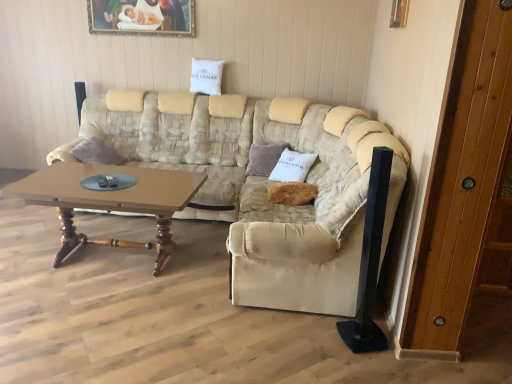
Measure the distance between point (67,202) and camera.

The distance of point (67,202) from camera is 8.98 feet.

Image resolution: width=512 pixels, height=384 pixels. Describe the element at coordinates (264, 158) in the screenshot. I see `velvet purple pillow at center, which appears as the 2th pillow when viewed from the top` at that location.

You are a GUI agent. You are given a task and a screenshot of the screen. Output one action in this format:
    pyautogui.click(x=<x>, y=<y>)
    Task: Click on the beige fabric armchair at center
    The image size is (512, 384).
    Given the screenshot: What is the action you would take?
    [x=302, y=280]

Where is `beige fabric couch at center`? beige fabric couch at center is located at coordinates (265, 190).

What do you see at coordinates (265, 190) in the screenshot? This screenshot has width=512, height=384. I see `beige fabric couch at center` at bounding box center [265, 190].

In order to face metallic gold picture frame at upper right, which ranks as the first picture frame in bottom-to-top order, should I rotate leftwards or rightwards?

Rotate right and turn 18.538 degrees.

This screenshot has width=512, height=384. What are the coordinates of `white fabric pillow at upper center, which ranks as the first pillow in left-to-right order` in the screenshot? It's located at (206, 76).

In terms of size, does white fabric pillow at upper center, which ranks as the first pillow in left-to-right order, appear bigger or smaller than brown wooden coffee table at center?

white fabric pillow at upper center, which ranks as the first pillow in left-to-right order, is smaller than brown wooden coffee table at center.

Based on the photo, considering their positions, is white fabric pillow at upper center, which ranks as the first pillow in left-to-right order, located in front of or behind brown wooden coffee table at center?

In the image, white fabric pillow at upper center, which ranks as the first pillow in left-to-right order, appears behind brown wooden coffee table at center.

Does point (220, 63) come behind point (53, 182)?

Yes, point (220, 63) is behind point (53, 182).

Is point (214, 84) positioned before point (371, 211)?

No, (214, 84) is further to viewer.

Which of these two, white fabric pillow at upper center, the 1th pillow from the back, or beige fabric armchair at center, is bigger?

beige fabric armchair at center.

How different are the orientations of white fabric pillow at upper center, which is counted as the third pillow, starting from the front, and beige fabric armchair at center in degrees?

They differ by 75.2 degrees in their facing directions.

From a real-world perspective, is white fabric pillow at upper center, the 1th pillow from the back, above or below beige fabric armchair at center?

white fabric pillow at upper center, the 1th pillow from the back, is above beige fabric armchair at center.

Considering the positions of points (405, 26) and (170, 109), is point (405, 26) farther from camera compared to point (170, 109)?

No, (405, 26) is in front of (170, 109).

How distant is metallic gold picture frame at upper right, which appears as the second picture frame when viewed from the back, from beige fabric couch at center?

metallic gold picture frame at upper right, which appears as the second picture frame when viewed from the back, and beige fabric couch at center are 5.09 feet apart.

Is metallic gold picture frame at upper right, which is counted as the 1th picture frame, starting from the front, positioned beyond the bounds of beige fabric couch at center?

Indeed, metallic gold picture frame at upper right, which is counted as the 1th picture frame, starting from the front, is completely outside beige fabric couch at center.

Who is shorter, metallic gold picture frame at upper right, which appears as the second picture frame when viewed from the back, or beige fabric couch at center?

With less height is metallic gold picture frame at upper right, which appears as the second picture frame when viewed from the back.

From a real-world perspective, is wooden door at right below beige fabric couch at center?

No, from a real-world perspective, wooden door at right is not under beige fabric couch at center.

From the image's perspective, is wooden door at right located beneath beige fabric couch at center?

Correct, wooden door at right appears lower than beige fabric couch at center in the image.

Based on the photo, considering the positions of objects wooden door at right and beige fabric couch at center in the image provided, who is more to the left, wooden door at right or beige fabric couch at center?

From the viewer's perspective, beige fabric couch at center appears more on the left side.

Which object is closer to the camera, wooden door at right or beige fabric couch at center?

wooden door at right is more forward.

Based on their positions, is fuzzy brown pillow at center, the third pillow from the back, located to the left or right of velvet purple pillow at center, the 2th pillow positioned from the left?

fuzzy brown pillow at center, the third pillow from the back, is to the right of velvet purple pillow at center, the 2th pillow positioned from the left.

Is fuzzy brown pillow at center, arranged as the 3th pillow when viewed from the left, behind velvet purple pillow at center, the second pillow from the bottom?

No, the depth of fuzzy brown pillow at center, arranged as the 3th pillow when viewed from the left, is less than that of velvet purple pillow at center, the second pillow from the bottom.

The height and width of the screenshot is (384, 512). I want to click on pillow that is the 3rd object located above the wooden door at right (from the image's perspective), so click(206, 76).

From the image's perspective, which one is positioned lower, wooden door at right or white fabric pillow at upper center, which ranks as the first pillow in left-to-right order?

From the image's view, wooden door at right is below.

Is white fabric pillow at upper center, which ranks as the first pillow in left-to-right order, inside wooden door at right?

No, white fabric pillow at upper center, which ranks as the first pillow in left-to-right order, is not surrounded by wooden door at right.

Considering the positions of point (490, 154) and point (220, 86), is point (490, 154) closer or farther from the camera than point (220, 86)?

Clearly, point (490, 154) is closer to the camera than point (220, 86).

Between point (288, 183) and point (150, 155), which one is positioned in front?

The point (288, 183) is more forward.

Between fuzzy brown pillow at center, which is the 1th pillow from right to left, and beige fabric couch at center, which one has more height?

beige fabric couch at center.

Is fuzzy brown pillow at center, the 3th pillow viewed from the top, facing towards beige fabric couch at center?

Yes, fuzzy brown pillow at center, the 3th pillow viewed from the top, is turned towards beige fabric couch at center.

Locate an element on the screen. coffee table below the white fabric pillow at upper center, the 3th pillow positioned from the right (from a real-world perspective) is located at coordinates (110, 200).

Find the location of a particular element. The image size is (512, 384). armchair in front of the white fabric pillow at upper center, the 1th pillow from the back is located at coordinates (302, 280).

Based on their spatial positions, is beige fabric armchair at center or metallic gold picture frame at upper right, which ranks as the first picture frame in bottom-to-top order, further from fuzzy brown pillow at center, arranged as the 3th pillow when viewed from the left?

metallic gold picture frame at upper right, which ranks as the first picture frame in bottom-to-top order, is positioned further to the anchor fuzzy brown pillow at center, arranged as the 3th pillow when viewed from the left.

In the scene shown: Based on their spatial positions, is fuzzy brown pillow at center, the first pillow ordered from the bottom, or white fabric pillow at upper center, the 3th pillow positioned from the right, further from brown wooden coffee table at center?

Based on the image, white fabric pillow at upper center, the 3th pillow positioned from the right, appears to be further to brown wooden coffee table at center.

Based on their spatial positions, is fuzzy brown pillow at center, the 1th pillow viewed from the front, or brown wooden coffee table at center closer to beige fabric armchair at center?

fuzzy brown pillow at center, the 1th pillow viewed from the front, lies closer to beige fabric armchair at center than the other object.

From the image, which object appears to be nearer to velvet purple pillow at center, placed as the second pillow when sorted from right to left, metallic gold picture frame at upper right, which is the 2th picture frame from left to right, or brown wooden coffee table at center?

brown wooden coffee table at center is closer to velvet purple pillow at center, placed as the second pillow when sorted from right to left.

When comparing their distances from fuzzy brown pillow at center, arranged as the 3th pillow when viewed from the left, does white fabric pillow at upper center, the 1th pillow from the back, or wooden painted picture frame at upper center, placed as the 1th picture frame when sorted from left to right, seem further?

wooden painted picture frame at upper center, placed as the 1th picture frame when sorted from left to right.

Which object lies nearer to the anchor point brown wooden coffee table at center, wooden painted picture frame at upper center, acting as the 2th picture frame starting from the bottom, or beige fabric armchair at center?

Based on the image, beige fabric armchair at center appears to be nearer to brown wooden coffee table at center.

Consider the image. Which object lies nearer to the anchor point velvet purple pillow at center, the second pillow from the bottom, metallic gold picture frame at upper right, which appears as the second picture frame when viewed from the back, or wooden painted picture frame at upper center, the 1th picture frame in the back-to-front sequence?

metallic gold picture frame at upper right, which appears as the second picture frame when viewed from the back.

Looking at this image, estimate the real-world distances between objects in this image. Which object is further from beige fabric couch at center, brown wooden coffee table at center or fuzzy brown pillow at center, the 3th pillow viewed from the top?

brown wooden coffee table at center.

Find the location of a particular element. This screenshot has height=384, width=512. pillow that lies between white fabric pillow at upper center, which ranks as the first pillow in left-to-right order, and fuzzy brown pillow at center, the 1th pillow viewed from the front, from top to bottom is located at coordinates (264, 158).

Where is `picture frame positioned between beige fabric armchair at center and velvet purple pillow at center, which appears as the 2th pillow when viewed from the top, from near to far`? picture frame positioned between beige fabric armchair at center and velvet purple pillow at center, which appears as the 2th pillow when viewed from the top, from near to far is located at coordinates (399, 13).

Identify the location of pillow positioned between beige fabric couch at center and velvet purple pillow at center, the 2th pillow positioned from the left, from near to far. The height and width of the screenshot is (384, 512). (x=291, y=193).

The width and height of the screenshot is (512, 384). Find the location of `picture frame located between wooden door at right and white fabric pillow at upper center, which is counted as the third pillow, starting from the front, in the depth direction`. picture frame located between wooden door at right and white fabric pillow at upper center, which is counted as the third pillow, starting from the front, in the depth direction is located at coordinates (399, 13).